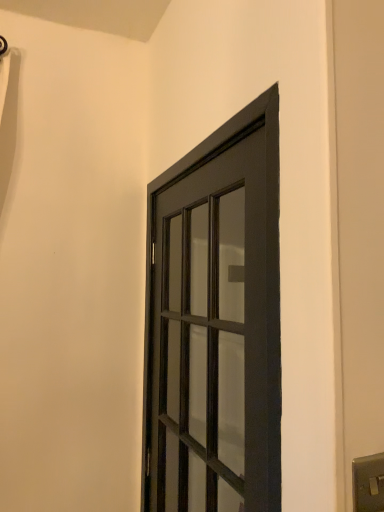
Question: In terms of height, does matte black door at center look taller or shorter compared to satin silver switch at lower right?

Choices:
 (A) short
 (B) tall

Answer: (B)

Question: Considering the relative positions of matte black door at center and satin silver switch at lower right in the image provided, is matte black door at center to the left or to the right of satin silver switch at lower right?

Choices:
 (A) left
 (B) right

Answer: (A)

Question: Looking at their shapes, would you say matte black door at center is wider or thinner than satin silver switch at lower right?

Choices:
 (A) wide
 (B) thin

Answer: (A)

Question: From their relative heights in the image, would you say satin silver switch at lower right is taller or shorter than matte black door at center?

Choices:
 (A) tall
 (B) short

Answer: (B)

Question: Is point (382, 503) closer or farther from the camera than point (221, 414)?

Choices:
 (A) closer
 (B) farther

Answer: (A)

Question: From a real-world perspective, is satin silver switch at lower right physically located above or below matte black door at center?

Choices:
 (A) below
 (B) above

Answer: (A)

Question: In the image, is satin silver switch at lower right positioned in front of or behind matte black door at center?

Choices:
 (A) front
 (B) behind

Answer: (A)